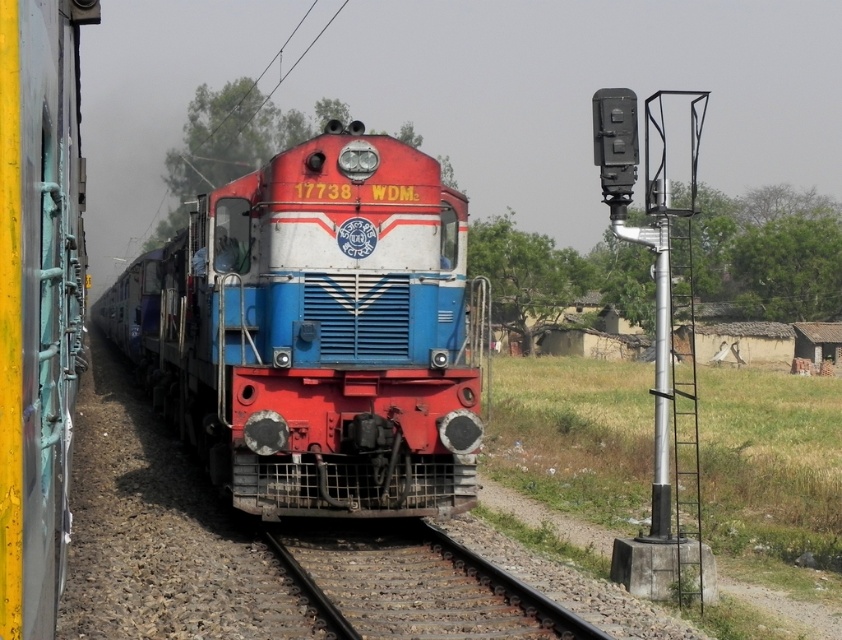
You are standing at the point marked as point (x=315, y=332) in the image. What object are you directly facing?

The point (x=315, y=332) corresponds to the shiny red locomotive at center, so you are directly facing the shiny red locomotive at center.

You are a photographer planning to take a photo of the shiny red locomotive at center and the rusty metal train track at center. Based on their sizes, which object should you focus on to ensure both are clearly visible in the frame?

The shiny red locomotive at center is larger than the rusty metal train track at center, so focusing on the shiny red locomotive at center will ensure both are clearly visible in the frame.

You are a railway engineer and need to determine if the shiny red locomotive at center can fit on the rusty metal train track at center. Based on their widths, can it fit?

The shiny red locomotive at center might be wider than rusty metal train track at center, so there is a possibility it cannot fit properly.